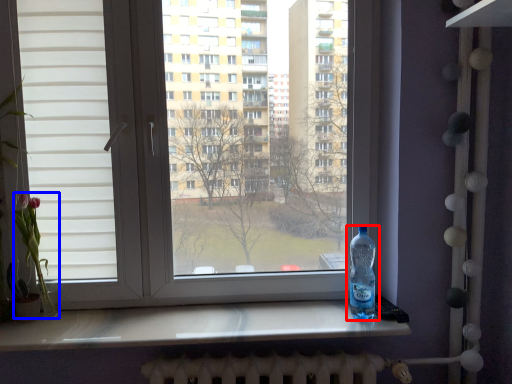
Question: Which of the following is the farthest to the observer, bottle (highlighted by a red box) or flower (highlighted by a blue box)?

Choices:
 (A) bottle
 (B) flower

Answer: (B)